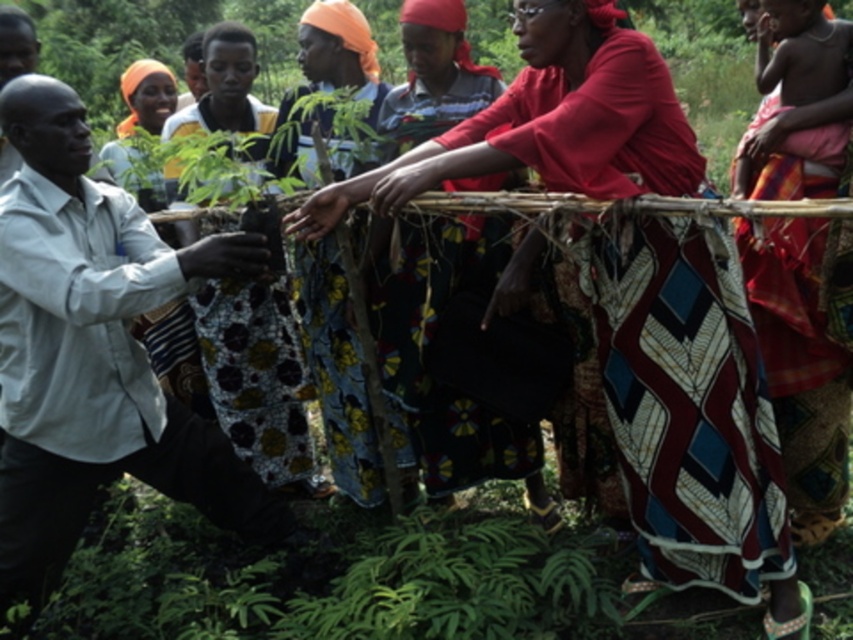
Question: Which point appears farthest from the camera in this image?

Choices:
 (A) (610, 296)
 (B) (39, 93)
 (C) (151, 67)

Answer: (C)

Question: From the image, what is the correct spatial relationship of red woven cloth at center in relation to light gray shirt at left?

Choices:
 (A) above
 (B) below

Answer: (A)

Question: Among these objects, which one is farthest from the camera?

Choices:
 (A) matte orange headscarf at upper left
 (B) red woven cloth at center

Answer: (A)

Question: From the image, what is the correct spatial relationship of red woven cloth at center in relation to matte orange headscarf at upper left?

Choices:
 (A) left
 (B) right

Answer: (B)

Question: Is red woven cloth at center above matte orange headscarf at upper left?

Choices:
 (A) yes
 (B) no

Answer: (B)

Question: Among these objects, which one is nearest to the camera?

Choices:
 (A) red woven cloth at center
 (B) matte orange headscarf at upper left
 (C) light gray shirt at left

Answer: (A)